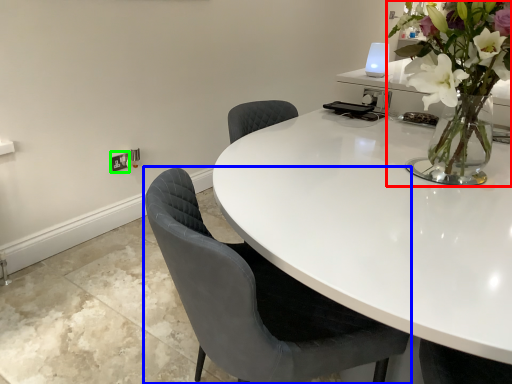
Question: Estimate the real-world distances between objects in this image. Which object is closer to houseplant (highlighted by a red box), chair (highlighted by a blue box) or electric outlet (highlighted by a green box)?

Choices:
 (A) chair
 (B) electric outlet

Answer: (A)